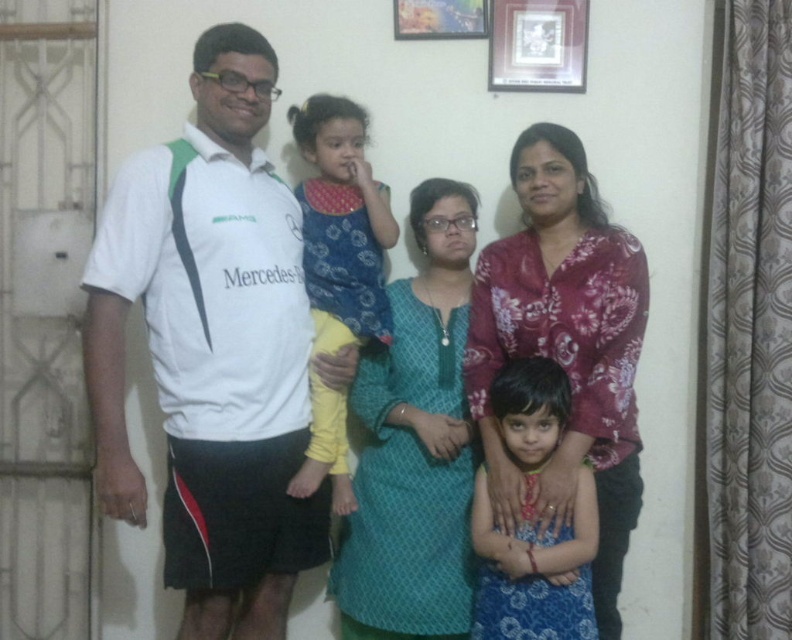
Who is more forward, (606, 104) or (314, 269)?

Positioned in front is point (314, 269).

Does white cotton shirt at left have a smaller size compared to blue printed dress at center?

Yes.

Measure the distance between white cotton shirt at left and camera.

2.35 meters

Locate an element on the screen. white cotton shirt at left is located at coordinates (368, 96).

Who is higher up, floral silk blouse at center or wooden frame at upper center?

wooden frame at upper center is above.

Measure the distance between floral silk blouse at center and wooden frame at upper center.

They are 29.54 inches apart.

At what (x,y) coordinates should I click in order to perform the action: click on floral silk blouse at center. Please return your answer as a coordinate pair (x, y). Looking at the image, I should click on (564, 348).

Who is more forward, (452, 356) or (535, 90)?

Point (452, 356)

Who is positioned more to the left, teal cotton kurta at center or metallic silver picture frame at upper center?

From the viewer's perspective, teal cotton kurta at center appears more on the left side.

This screenshot has height=640, width=792. What do you see at coordinates (414, 444) in the screenshot?
I see `teal cotton kurta at center` at bounding box center [414, 444].

The height and width of the screenshot is (640, 792). Find the location of `teal cotton kurta at center`. teal cotton kurta at center is located at coordinates (414, 444).